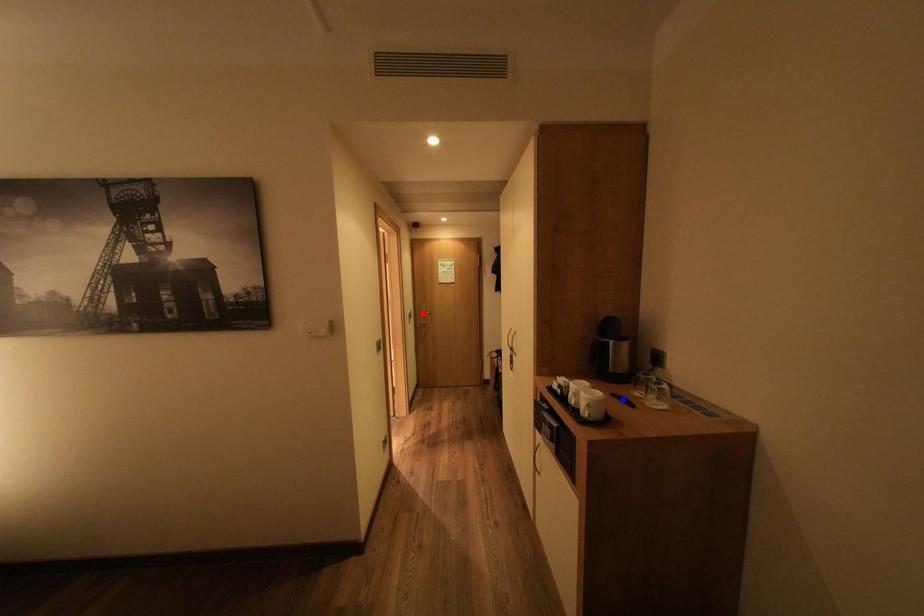
Question: Which of the two points in the image is closer to the camera?

Choices:
 (A) Blue point is closer.
 (B) Red point is closer.

Answer: (A)